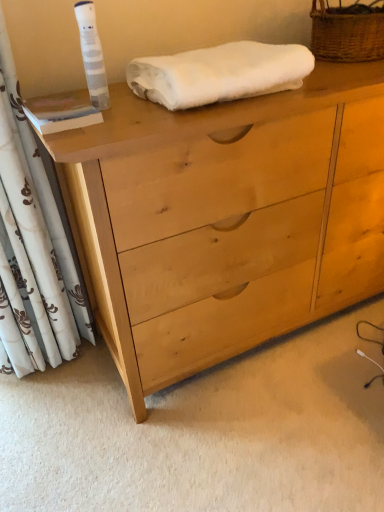
The image size is (384, 512). Describe the element at coordinates (33, 245) in the screenshot. I see `white floral fabric curtain at left` at that location.

Image resolution: width=384 pixels, height=512 pixels. I want to click on woven brown basket at upper right, so [347, 32].

Is woven brown basket at upper right not inside white fluffy towel at upper center?

woven brown basket at upper right is positioned outside white fluffy towel at upper center.

Considering their positions, is woven brown basket at upper right located in front of or behind white fluffy towel at upper center?

woven brown basket at upper right is positioned farther from the viewer than white fluffy towel at upper center.

Locate an element on the screen. basket that appears above the white fluffy towel at upper center (from a real-world perspective) is located at coordinates (347, 32).

From a real-world perspective, between woven brown basket at upper right and white fluffy towel at upper center, who is vertically lower?

white fluffy towel at upper center.

Looking at the image, does white floral fabric curtain at left seem bigger or smaller compared to white fluffy towel at upper center?

In the image, white floral fabric curtain at left appears to be larger than white fluffy towel at upper center.

Which is more to the right, white floral fabric curtain at left or white fluffy towel at upper center?

From the viewer's perspective, white fluffy towel at upper center appears more on the right side.

Identify the location of curtain in front of the white fluffy towel at upper center. (33, 245).

Is white floral fabric curtain at left in contact with white fluffy towel at upper center?

There is a gap between white floral fabric curtain at left and white fluffy towel at upper center.

Is white fluffy towel at upper center not inside light wood chest of drawers at center?

Yes, white fluffy towel at upper center is located beyond the bounds of light wood chest of drawers at center.

Is white fluffy towel at upper center oriented away from light wood chest of drawers at center?

No, white fluffy towel at upper center is not facing the opposite direction of light wood chest of drawers at center.

From a real-world perspective, is white fluffy towel at upper center on top of light wood chest of drawers at center?

Yes, from a real-world perspective, white fluffy towel at upper center is over light wood chest of drawers at center

Is white fluffy towel at upper center smaller than light wood chest of drawers at center?

Correct, white fluffy towel at upper center occupies less space than light wood chest of drawers at center.

Which of these two, white floral fabric curtain at left or woven brown basket at upper right, is wider?

woven brown basket at upper right.

Does point (22, 156) lie behind point (312, 14)?

No, (22, 156) is in front of (312, 14).

Is white floral fabric curtain at left shorter than woven brown basket at upper right?

No.

From a real-world perspective, relative to light wood chest of drawers at center, is woven brown basket at upper right vertically above or below?

woven brown basket at upper right is situated higher than light wood chest of drawers at center in the real world.

From the image's perspective, relative to light wood chest of drawers at center, is woven brown basket at upper right above or below?

From the image's perspective, woven brown basket at upper right appears above light wood chest of drawers at center.

Which object is positioned more to the right, woven brown basket at upper right or light wood chest of drawers at center?

From the viewer's perspective, woven brown basket at upper right appears more on the right side.

Does woven brown basket at upper right have a greater width compared to light wood chest of drawers at center?

Incorrect, the width of woven brown basket at upper right does not surpass that of light wood chest of drawers at center.

Could you tell me if white fluffy towel at upper center is facing white floral fabric curtain at left?

No, white fluffy towel at upper center is not oriented towards white floral fabric curtain at left.

Locate an element on the screen. This screenshot has height=512, width=384. bath towel lying on the right of white floral fabric curtain at left is located at coordinates (219, 73).

From their relative heights in the image, would you say white fluffy towel at upper center is taller or shorter than white floral fabric curtain at left?

white fluffy towel at upper center is shorter than white floral fabric curtain at left.

Is light wood chest of drawers at center aimed at white fluffy towel at upper center?

No, light wood chest of drawers at center is not aimed at white fluffy towel at upper center.

From the image's perspective, is light wood chest of drawers at center above or below white fluffy towel at upper center?

From the image's perspective, light wood chest of drawers at center appears below white fluffy towel at upper center.

Is there a large distance between light wood chest of drawers at center and white fluffy towel at upper center?

That's not correct — light wood chest of drawers at center is a little close to white fluffy towel at upper center.

Can you confirm if light wood chest of drawers at center is smaller than white fluffy towel at upper center?

No, light wood chest of drawers at center is not smaller than white fluffy towel at upper center.

Locate an element on the screen. The image size is (384, 512). basket that is above the white fluffy towel at upper center (from a real-world perspective) is located at coordinates (347, 32).

Where is `bath towel behind the white floral fabric curtain at left`? The height and width of the screenshot is (512, 384). bath towel behind the white floral fabric curtain at left is located at coordinates (219, 73).

Considering their positions, is white floral fabric curtain at left positioned closer to white fluffy towel at upper center than light wood chest of drawers at center?

light wood chest of drawers at center is closer to white fluffy towel at upper center.

Estimate the real-world distances between objects in this image. Which object is further from white fluffy towel at upper center, white floral fabric curtain at left or woven brown basket at upper right?

white floral fabric curtain at left is further to white fluffy towel at upper center.

Looking at the image, which one is located closer to white floral fabric curtain at left, woven brown basket at upper right or white fluffy towel at upper center?

white fluffy towel at upper center lies closer to white floral fabric curtain at left than the other object.

Looking at the image, which one is located further to white fluffy towel at upper center, woven brown basket at upper right or white floral fabric curtain at left?

white floral fabric curtain at left is further to white fluffy towel at upper center.

From the image, which object appears to be nearer to woven brown basket at upper right, white floral fabric curtain at left or white fluffy towel at upper center?

white fluffy towel at upper center is closer to woven brown basket at upper right.

Looking at this image, when comparing their distances from white floral fabric curtain at left, does light wood chest of drawers at center or woven brown basket at upper right seem closer?

light wood chest of drawers at center lies closer to white floral fabric curtain at left than the other object.

Which object lies nearer to the anchor point white fluffy towel at upper center, woven brown basket at upper right or light wood chest of drawers at center?

The object closer to white fluffy towel at upper center is light wood chest of drawers at center.

Looking at the image, which one is located further to light wood chest of drawers at center, woven brown basket at upper right or white fluffy towel at upper center?

woven brown basket at upper right is further to light wood chest of drawers at center.

Locate an element on the screen. The width and height of the screenshot is (384, 512). chest of drawers between white floral fabric curtain at left and woven brown basket at upper right in the horizontal direction is located at coordinates (200, 241).

This screenshot has width=384, height=512. Identify the location of bath towel that lies between woven brown basket at upper right and light wood chest of drawers at center from top to bottom. (219, 73).

This screenshot has width=384, height=512. I want to click on bath towel between white floral fabric curtain at left and woven brown basket at upper right in the horizontal direction, so click(219, 73).

Image resolution: width=384 pixels, height=512 pixels. What are the coordinates of `bath towel situated between white floral fabric curtain at left and light wood chest of drawers at center from left to right` in the screenshot? It's located at (219, 73).